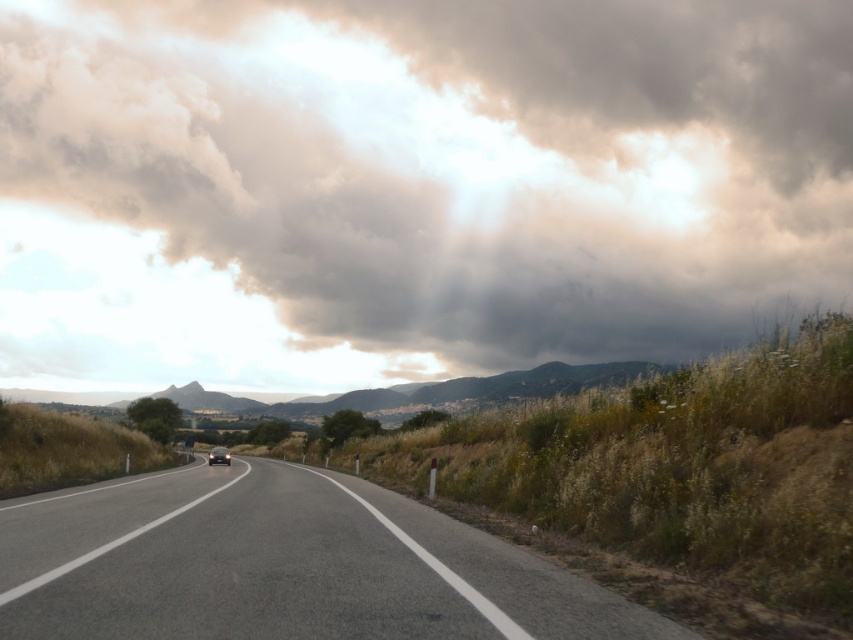
You are a driver approaching the asphalt road at center. You notice a gray fluffy cloud at upper center in the distance. Which object appears larger in the scene?

The gray fluffy cloud at upper center appears larger than the asphalt road at center in the scene.

You are a driver approaching the shiny black car at center on the gray asphalt road. You notice a gray fluffy cloud at upper center in the sky. Which object appears bigger in the scene?

The gray fluffy cloud at upper center appears bigger than the shiny black car at center because it is larger in size.